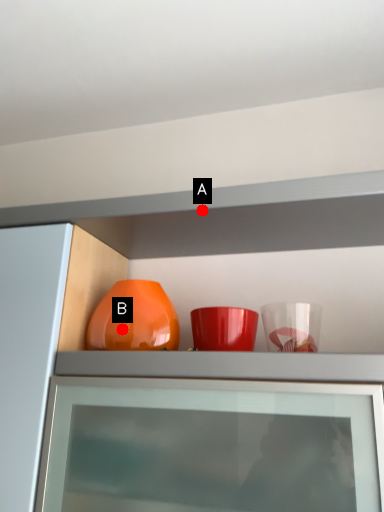
Question: Two points are circled on the image, labeled by A and B beside each circle. Which of the following is the closest to the observer?

Choices:
 (A) A is closer
 (B) B is closer

Answer: (A)